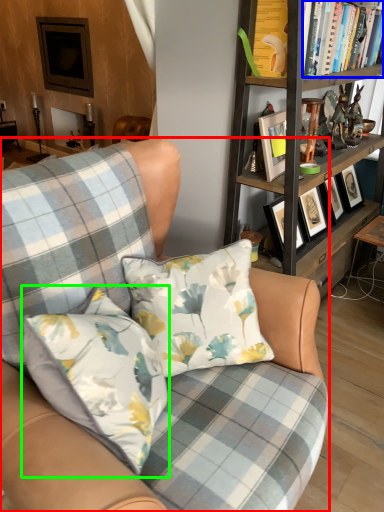
Question: Based on their relative distances, which object is farther from chair (highlighted by a red box)? Choose from book (highlighted by a blue box) and pillow (highlighted by a green box).

Choices:
 (A) book
 (B) pillow

Answer: (A)